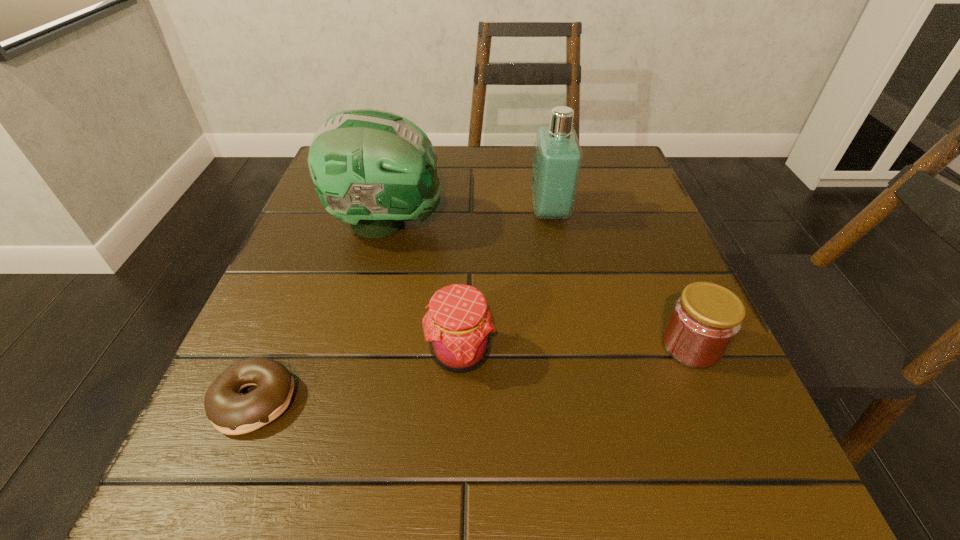
Locate an element on the screen. This screenshot has width=960, height=540. vacant region between the fourth object from left to right and the doughnut is located at coordinates (401, 306).

This screenshot has height=540, width=960. What are the coordinates of `vacant point located between the shortest object and the left jam` in the screenshot? It's located at (x=357, y=376).

You are a GUI agent. You are given a task and a screenshot of the screen. Output one action in this format:
    pyautogui.click(x=<x>, y=<y>)
    Task: Click on the blank region between the right jam and the football helmet
    The image size is (960, 540).
    Given the screenshot: What is the action you would take?
    (x=539, y=285)

Locate an element on the screen. The image size is (960, 540). free spot between the football helmet and the rightmost object is located at coordinates (539, 285).

At what (x,y) coordinates should I click in order to perform the action: click on object that stands as the second closest to the football helmet. Please return your answer as a coordinate pair (x, y). This screenshot has height=540, width=960. Looking at the image, I should click on point(557,161).

At what (x,y) coordinates should I click in order to perform the action: click on object that stands as the fourth closest to the rightmost object. Please return your answer as a coordinate pair (x, y). The width and height of the screenshot is (960, 540). Looking at the image, I should click on (230, 412).

Locate an element on the screen. This screenshot has height=540, width=960. vacant space that satisfies the following two spatial constraints: 1. on the visor of the football helmet; 2. on the back side of the rightmost object is located at coordinates (356, 346).

Locate an element on the screen. vacant region that satisfies the following two spatial constraints: 1. on the back side of the doughnut; 2. on the right side of the rightmost object is located at coordinates 276,346.

The width and height of the screenshot is (960, 540). What are the coordinates of `free space that satisfies the following two spatial constraints: 1. on the visor of the left jam; 2. on the left side of the football helmet` in the screenshot? It's located at (354, 353).

The image size is (960, 540). I want to click on free space that satisfies the following two spatial constraints: 1. on the front label of the second object from right to left; 2. on the front side of the shortest object, so click(586, 400).